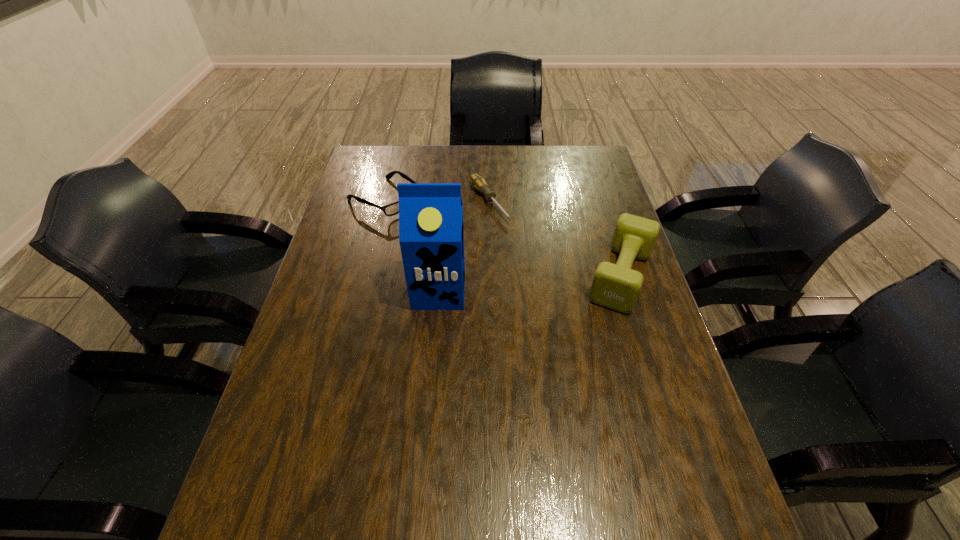
Identify which object is the third nearest to the spectacles. Please provide its 2D coordinates. Your answer should be formatted as a tuple, i.e. [(x, y)], where the tuple contains the x and y coordinates of a point satisfying the conditions above.

[(616, 286)]

Where is `the third closest object relative to the dumbbell`? The height and width of the screenshot is (540, 960). the third closest object relative to the dumbbell is located at coordinates (392, 209).

At what (x,y) coordinates should I click in order to perform the action: click on free point that satisfies the following two spatial constraints: 1. on the front side of the second tallest object; 2. on the right side of the third object from left to right. Please return your answer as a coordinate pair (x, y). The width and height of the screenshot is (960, 540). Looking at the image, I should click on (492, 276).